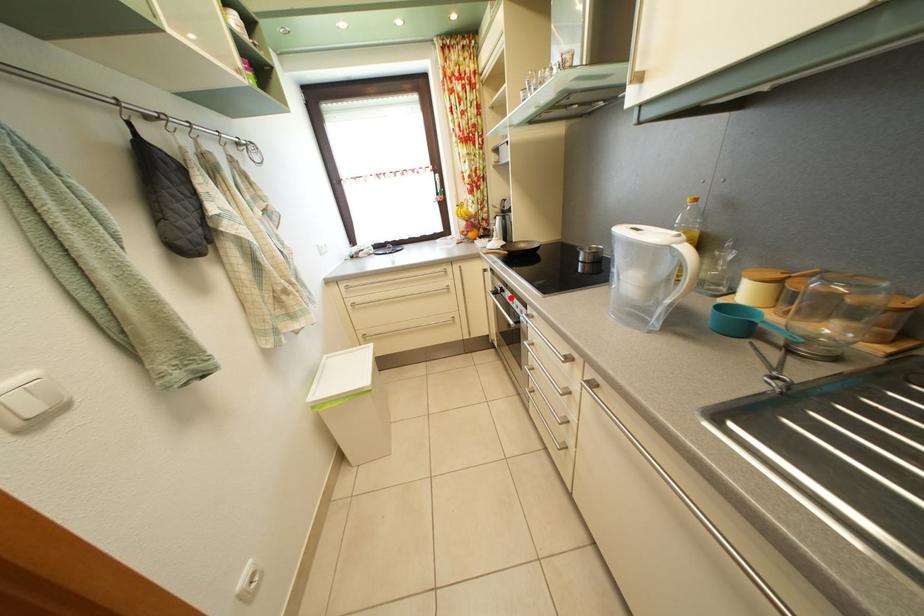
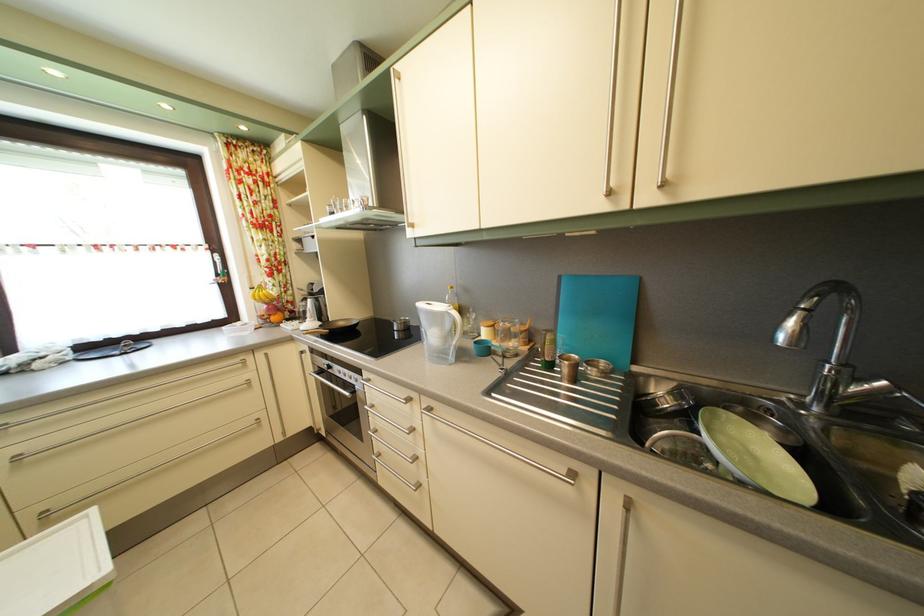
Question: A red point is marked in image1. In image2, is the corresponding 3D point closer to the camera or farther? Reply with the corresponding letter.

Choices:
 (A) The corresponding 3D point is closer.
 (B) The corresponding 3D point is farther.

Answer: (B)